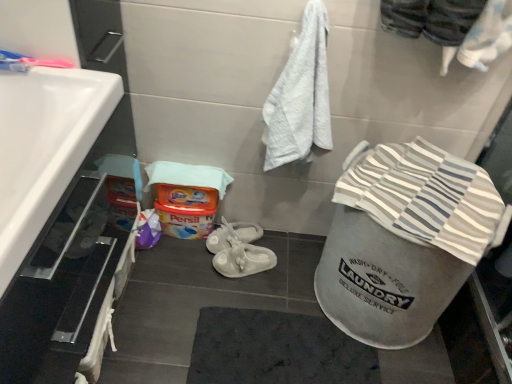
This screenshot has width=512, height=384. I want to click on vacant space to the right of white rubber sandals at center, so click(292, 272).